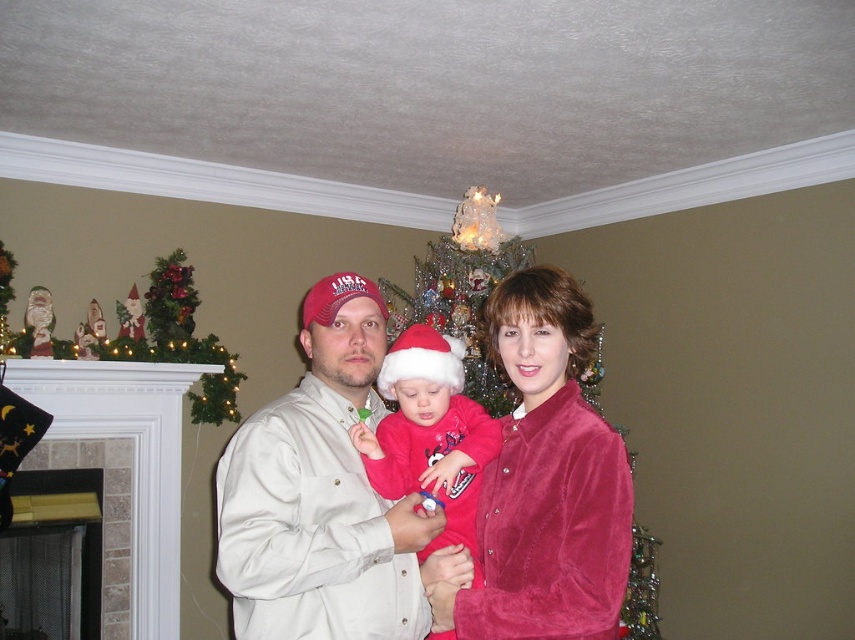
In the scene shown: Is matte khaki shirt at center bigger than matte pink fabric at center?

Indeed, matte khaki shirt at center has a larger size compared to matte pink fabric at center.

Does matte khaki shirt at center appear under matte pink fabric at center?

Actually, matte khaki shirt at center is above matte pink fabric at center.

Which is behind, point (339, 525) or point (453, 518)?

Positioned behind is point (453, 518).

Where is `matte khaki shirt at center`? The width and height of the screenshot is (855, 640). matte khaki shirt at center is located at coordinates (321, 493).

What do you see at coordinates (121, 474) in the screenshot? This screenshot has height=640, width=855. I see `white tile fireplace at lower left` at bounding box center [121, 474].

In order to click on white tile fireplace at lower left in this screenshot , I will do pos(121,474).

Can you confirm if velvet red shirt at center is positioned above matte pink fabric at center?

Yes, velvet red shirt at center is above matte pink fabric at center.

Can you confirm if velvet red shirt at center is positioned below matte pink fabric at center?

No, velvet red shirt at center is not below matte pink fabric at center.

Between point (541, 321) and point (472, 493), which one is positioned behind?

Point (472, 493)

This screenshot has width=855, height=640. I want to click on velvet red shirt at center, so click(x=546, y=481).